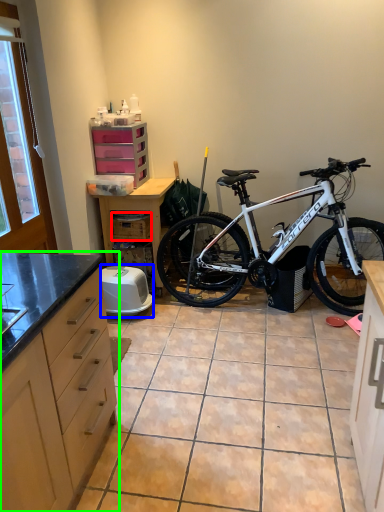
Question: Which object is the farthest from crate (highlighted by a red box)? Choose among these: appliance (highlighted by a blue box) or cabinetry (highlighted by a green box).

Choices:
 (A) appliance
 (B) cabinetry

Answer: (B)